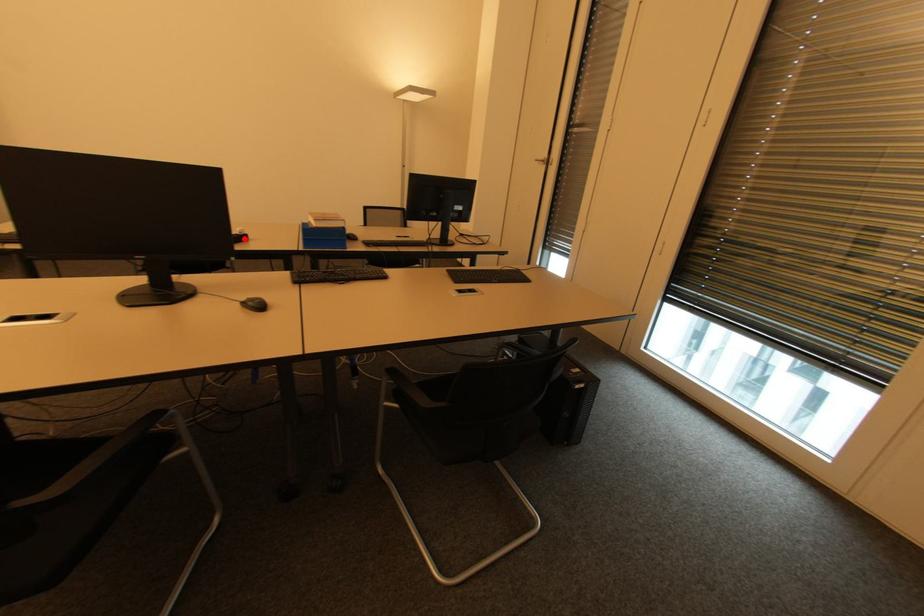
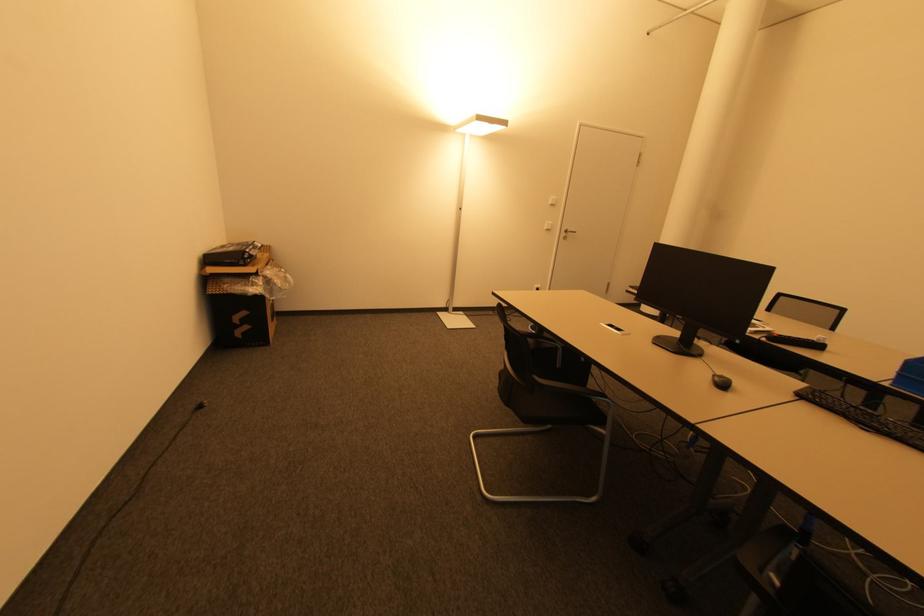
Question: A red point is marked in image1. In image2, is the corresponding 3D point closer to the camera or farther? Reply with the corresponding letter.

Choices:
 (A) The corresponding 3D point is closer.
 (B) The corresponding 3D point is farther.

Answer: (B)